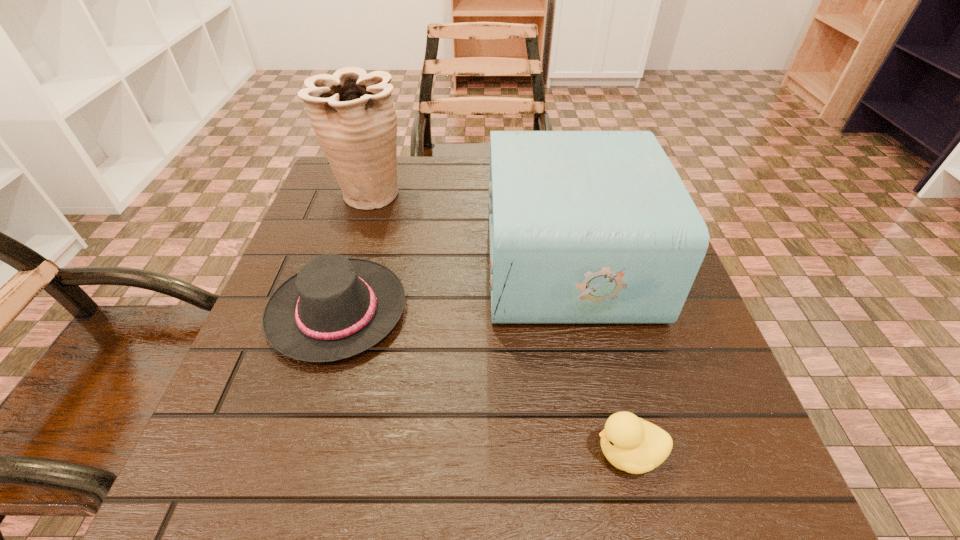
The height and width of the screenshot is (540, 960). Identify the location of empty location between the dress hat and the duck. (483, 382).

Identify the location of empty location between the tallest object and the dress hat. (354, 252).

You are a GUI agent. You are given a task and a screenshot of the screen. Output one action in this format:
    pyautogui.click(x=<x>, y=<y>)
    Task: Click on the empty space that is in between the second tallest object and the dress hat
    
    Given the screenshot: What is the action you would take?
    pyautogui.click(x=452, y=286)

Identify the location of free spot between the tallest object and the dress hat. Image resolution: width=960 pixels, height=540 pixels. (354, 252).

Locate an element on the screen. The image size is (960, 540). free area in between the tallest object and the dress hat is located at coordinates (354, 252).

What are the coordinates of `free spot between the second tallest object and the tallest object` in the screenshot? It's located at (468, 227).

Image resolution: width=960 pixels, height=540 pixels. Identify the location of the closest object to the radio receiver. (335, 307).

This screenshot has height=540, width=960. In order to click on object that is the second closest to the dress hat in this screenshot , I will do `click(352, 113)`.

At what (x,y) coordinates should I click in order to perform the action: click on vacant area in the image that satisfies the following two spatial constraints: 1. on the front side of the tallest object; 2. on the left side of the dress hat. Please return your answer as a coordinate pair (x, y). The width and height of the screenshot is (960, 540). Looking at the image, I should click on (333, 311).